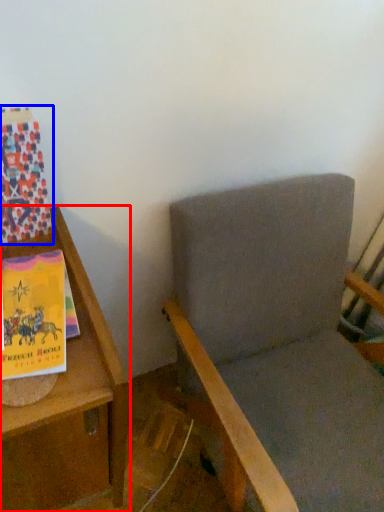
Question: Which object appears closest to the camera in this image, furniture (highlighted by a red box) or paperback book (highlighted by a blue box)?

Choices:
 (A) furniture
 (B) paperback book

Answer: (A)